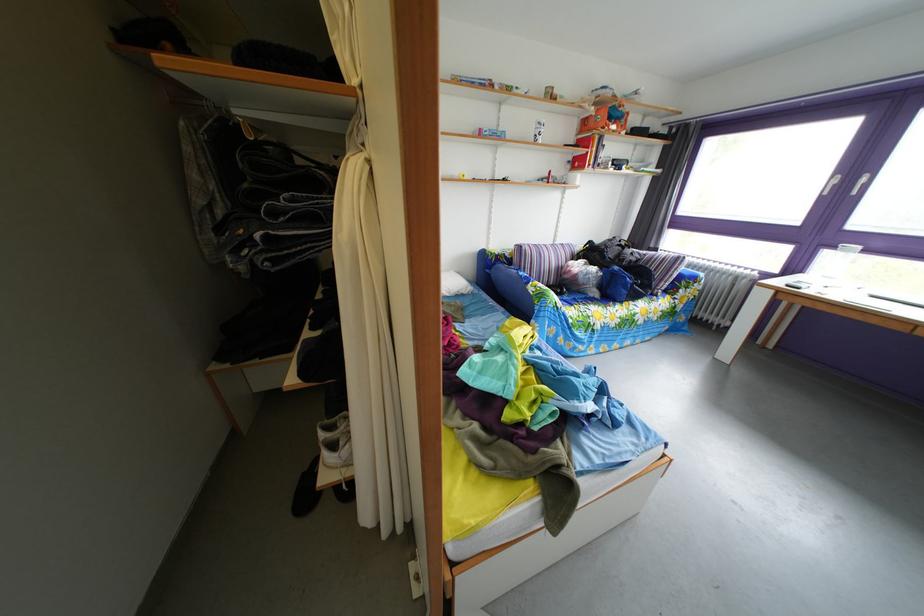
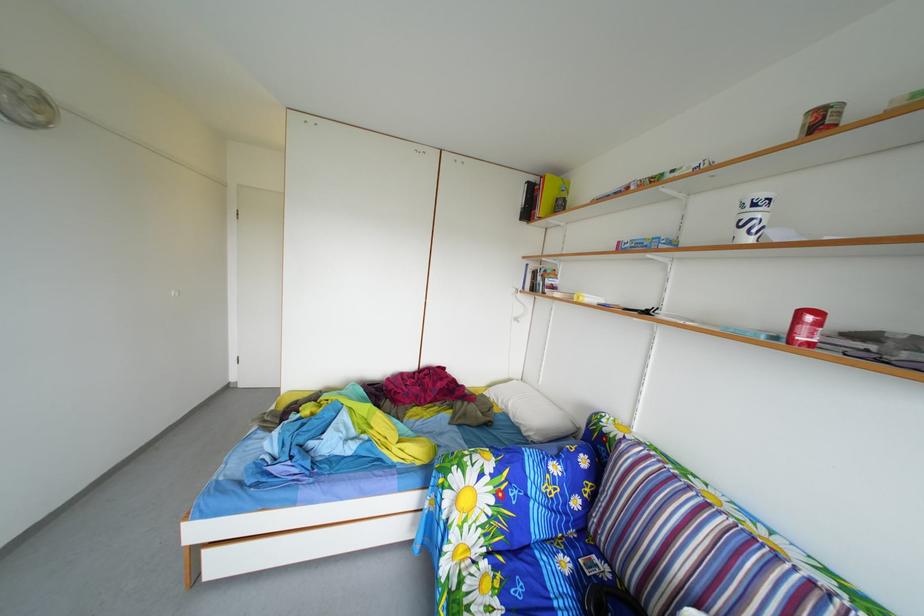
The point at (561, 180) is marked in the first image. Where is the corresponding point in the second image?

(811, 321)